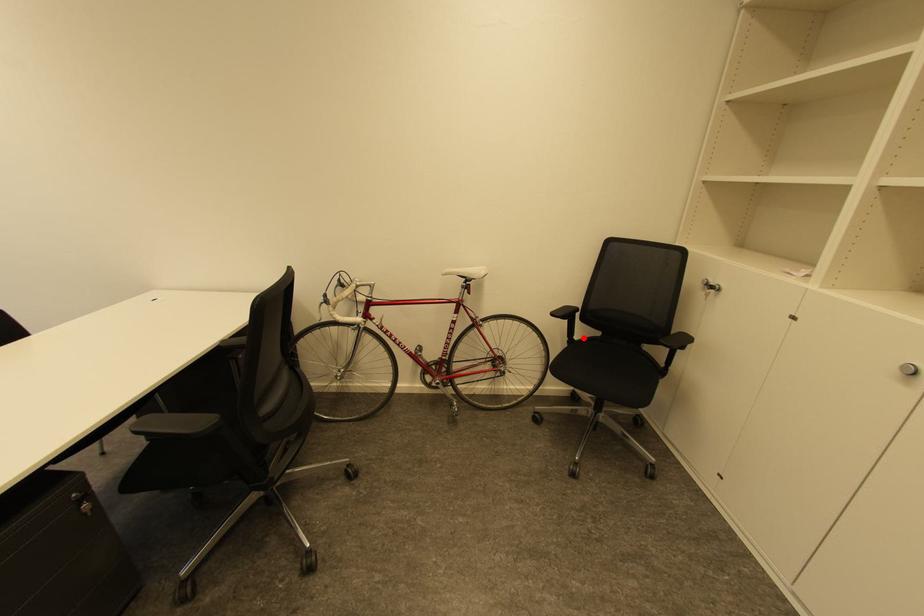
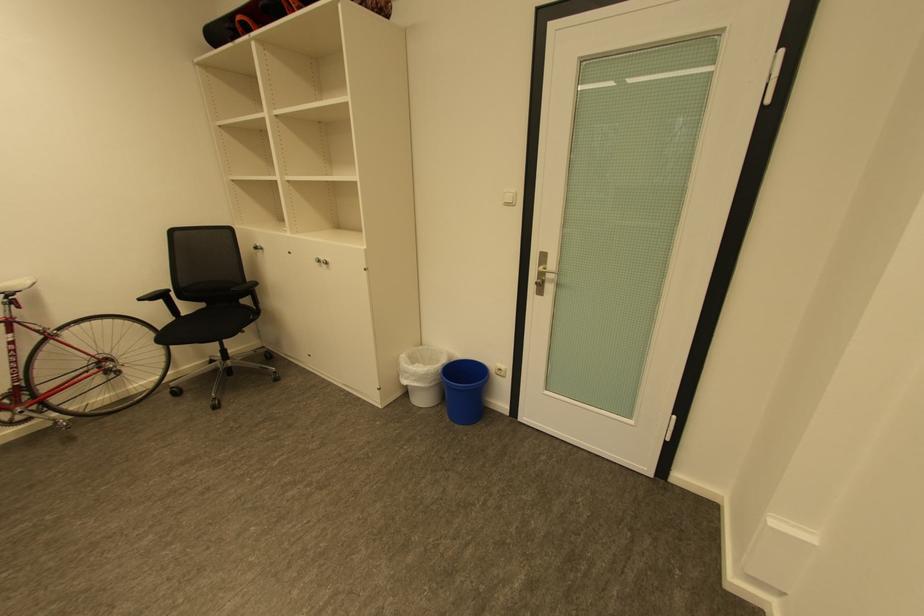
Where in the second image is the point corresponding to the highlighted location from the first image?

(190, 315)